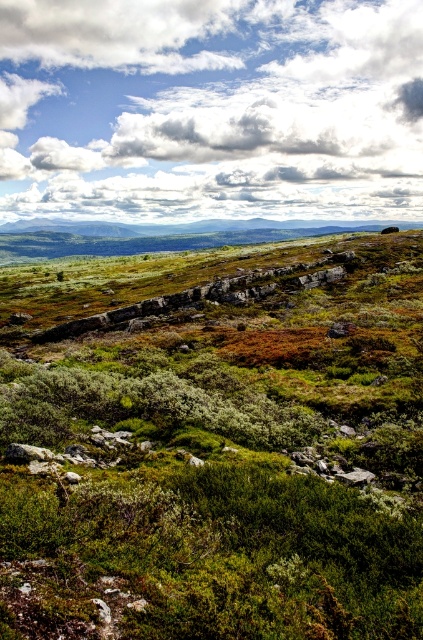
Is green grassy field at center taller than white fluffy cloud at upper center?

In fact, green grassy field at center may be shorter than white fluffy cloud at upper center.

Can you confirm if green grassy field at center is positioned to the right of white fluffy cloud at upper center?

Indeed, green grassy field at center is positioned on the right side of white fluffy cloud at upper center.

Between point (128, 481) and point (365, 48), which one is positioned in front?

Point (128, 481) is more forward.

Locate an element on the screen. green grassy field at center is located at coordinates (219, 451).